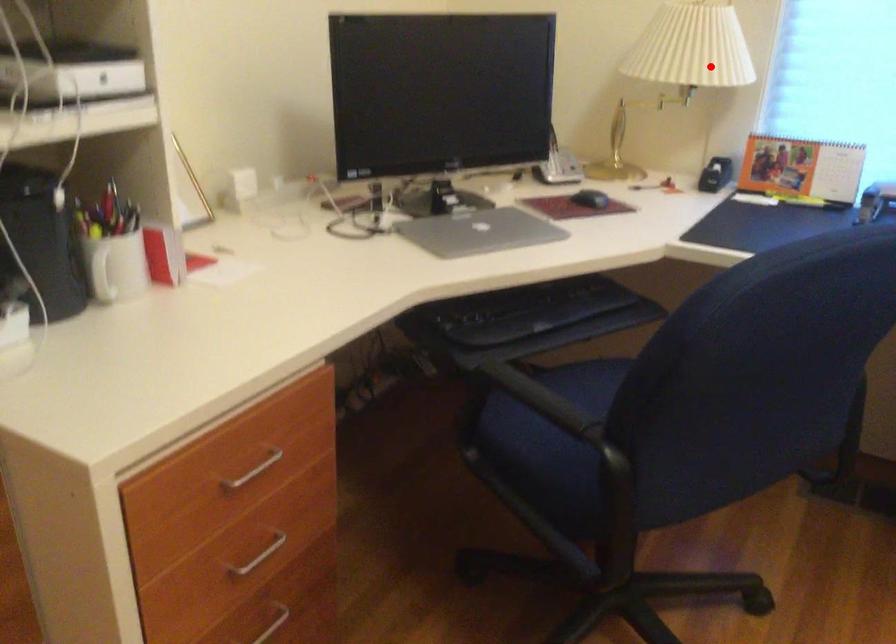
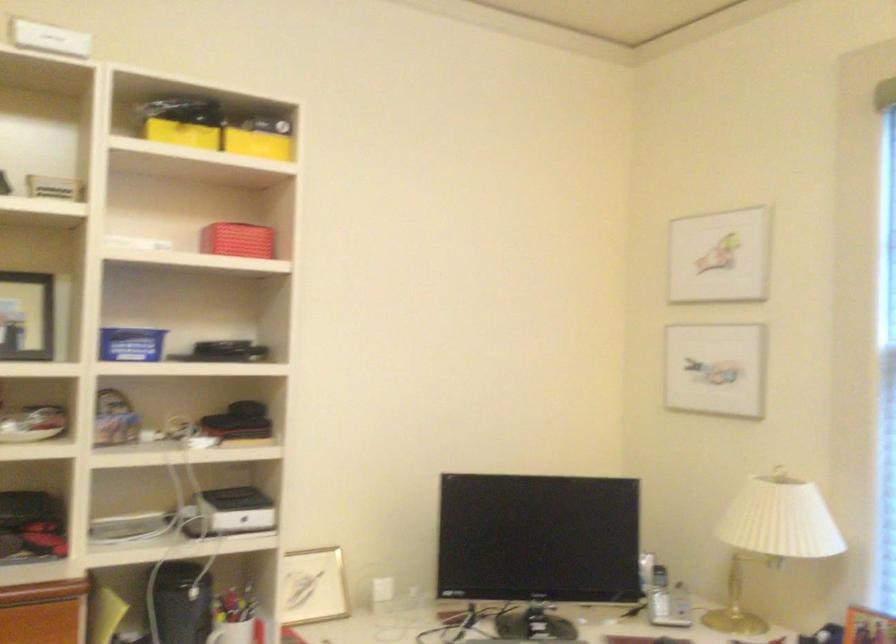
The point at the highlighted location is marked in the first image. Where is the corresponding point in the second image?

(771, 538)